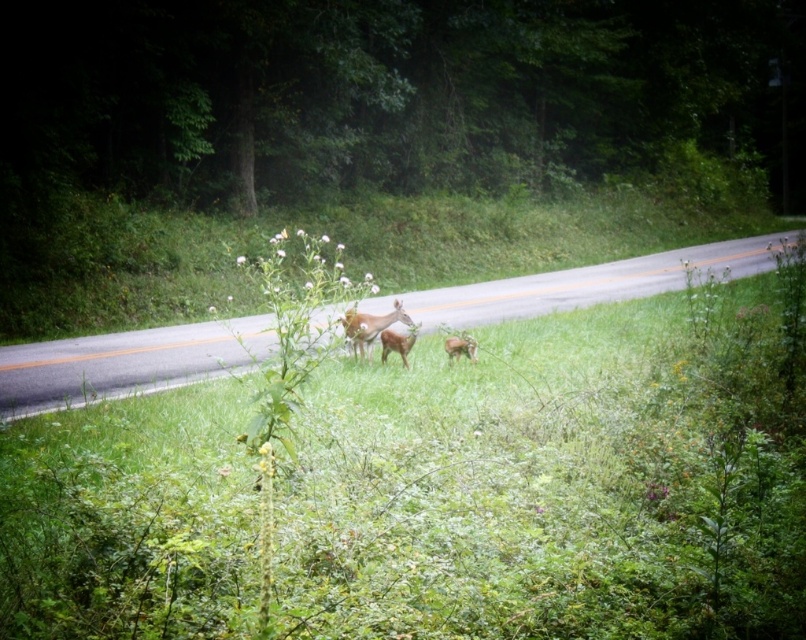
Which is in front, point (742, 371) or point (356, 332)?

Point (742, 371) is in front.

Is point (638, 316) behind point (364, 321)?

Yes, it is behind point (364, 321).

The image size is (806, 640). I want to click on green leafy grass at center, so click(441, 484).

Is green grass at center closer to camera compared to brown furry deer at center?

No, it is not.

Describe the element at coordinates (347, 250) in the screenshot. The height and width of the screenshot is (640, 806). I see `green grass at center` at that location.

Identify the location of green grass at center. (347, 250).

Is brown matte deer at center further to the viewer compared to brown furry deer at center?

No.

Does point (380, 337) come in front of point (455, 346)?

No, (380, 337) is behind (455, 346).

Is point (393, 346) positioned before point (468, 346)?

No, (393, 346) is behind (468, 346).

Locate an element on the screen. brown matte deer at center is located at coordinates (397, 342).